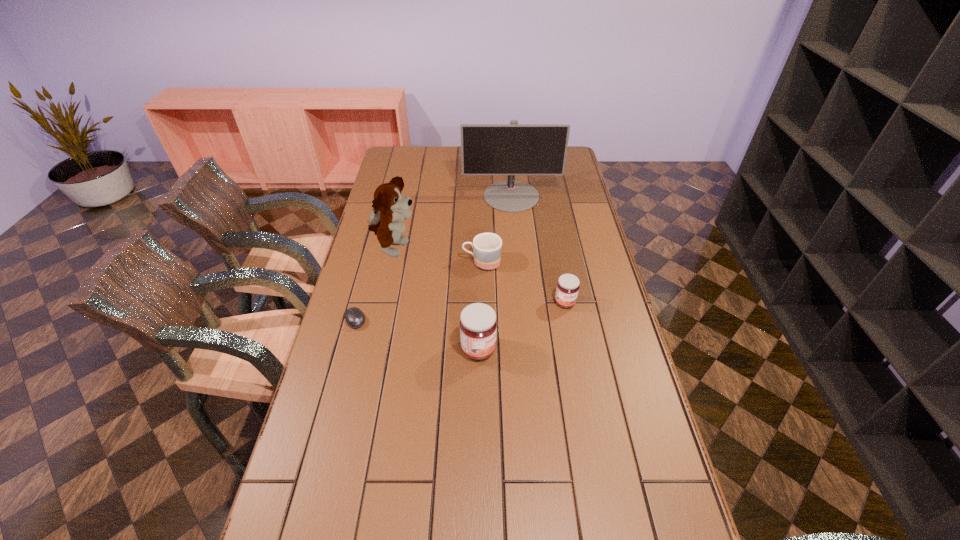
What are the coordinates of `vacant point located 0.150m on the screen of the computer monitor` in the screenshot? It's located at (515, 235).

You are a GUI agent. You are given a task and a screenshot of the screen. Output one action in this format:
    pyautogui.click(x=<x>, y=<y>)
    Task: Click on the free space located 0.370m on the face of the puppy
    This screenshot has width=960, height=540.
    Given the screenshot: What is the action you would take?
    pyautogui.click(x=518, y=249)

Locate an element on the screen. Image resolution: width=960 pixels, height=540 pixels. free spot located on the front of the shortest object is located at coordinates (338, 383).

What are the coordinates of `vacant area located on the side with the handle of the mug` in the screenshot? It's located at (426, 262).

Where is `free spot located on the side with the handle of the mug`? free spot located on the side with the handle of the mug is located at coordinates (418, 262).

Find the location of a particular element. free space located on the side with the handle of the mug is located at coordinates (441, 262).

Find the location of a particular element. puppy at the left edge is located at coordinates (390, 207).

At what (x,y) coordinates should I click in order to perform the action: click on computer mouse that is at the left edge. Please return your answer as a coordinate pair (x, y). Image resolution: width=960 pixels, height=540 pixels. Looking at the image, I should click on (355, 318).

Image resolution: width=960 pixels, height=540 pixels. I want to click on jam situated at the right edge, so click(x=567, y=289).

Where is `computer monitor present at the right edge`? The height and width of the screenshot is (540, 960). computer monitor present at the right edge is located at coordinates (512, 149).